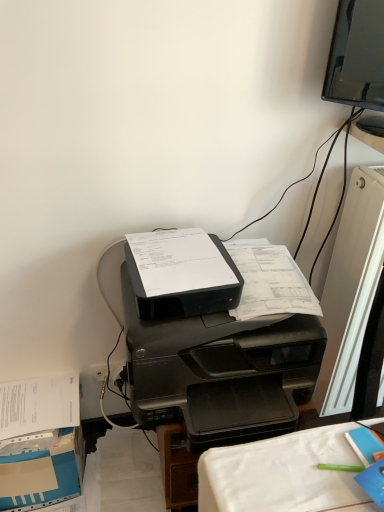
Locate an element on the screen. free space above blue cardboard box at lower left (from a real-world perspective) is located at coordinates (35, 406).